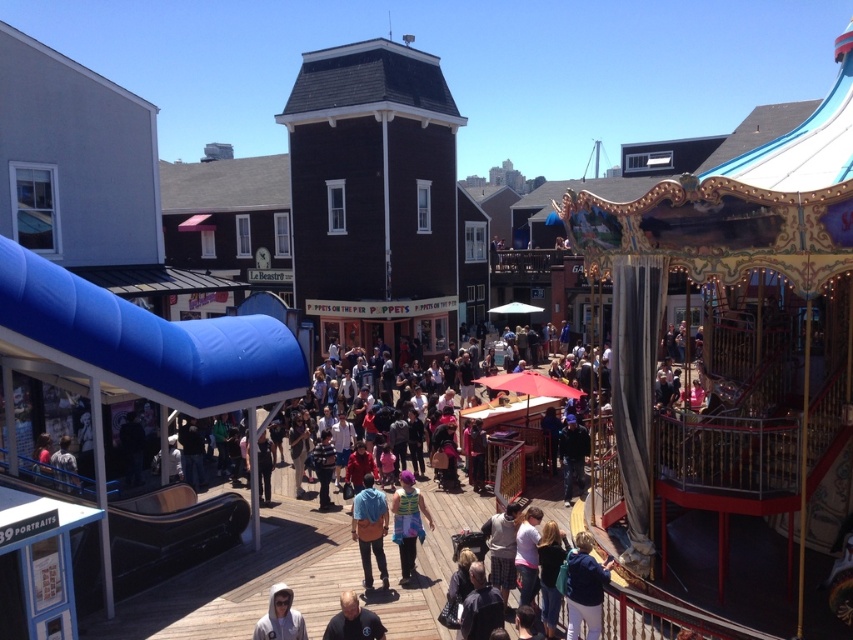
Question: Is blue denim jacket at center below white hoodie at lower center?

Choices:
 (A) no
 (B) yes

Answer: (A)

Question: Does blue denim jacket at lower right have a larger size compared to white hoodie at lower center?

Choices:
 (A) yes
 (B) no

Answer: (A)

Question: Among these objects, which one is farthest from the camera?

Choices:
 (A) blue denim jacket at lower right
 (B) blue denim jacket at center
 (C) shiny purple hair at center

Answer: (C)

Question: Which of these objects is positioned farthest from the white hoodie at lower center?

Choices:
 (A) dark blue uniform at lower center
 (B) shiny purple hair at center
 (C) blue denim jacket at center
 (D) blue denim jacket at lower right

Answer: (D)

Question: Estimate the real-world distances between objects in this image. Which object is farther from the dark blue uniform at lower center?

Choices:
 (A) blue denim jacket at center
 (B) shiny purple hair at center

Answer: (B)

Question: Can you confirm if blue denim jacket at lower right is positioned above blue denim jacket at center?

Choices:
 (A) no
 (B) yes

Answer: (A)